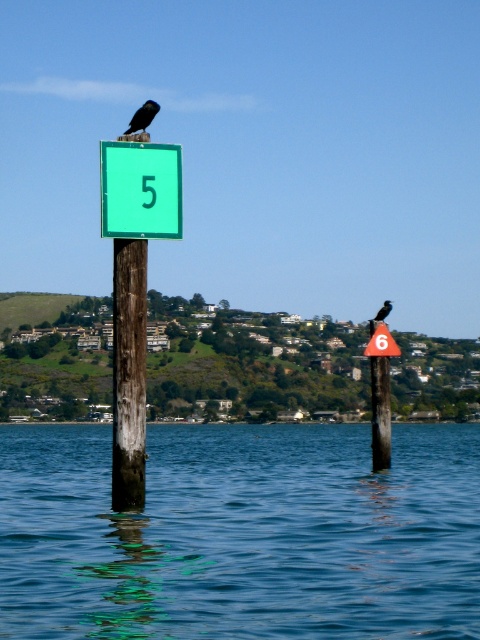
The height and width of the screenshot is (640, 480). Describe the element at coordinates (241, 534) in the screenshot. I see `transparent blue water at center` at that location.

Consider the image. Is transparent blue water at center closer to the viewer compared to red plastic triangle at right?

Yes, it is in front of red plastic triangle at right.

The image size is (480, 640). Identify the location of transparent blue water at center. (241, 534).

This screenshot has height=640, width=480. I want to click on transparent blue water at center, so click(x=241, y=534).

Is the position of green matte sign at upper center more distant than that of smooth wood post at right?

No, green matte sign at upper center is in front of smooth wood post at right.

Is green matte sign at upper center above smooth wood post at right?

Yes.

Is point (170, 227) closer to camera compared to point (375, 381)?

Yes, point (170, 227) is closer to viewer.

The width and height of the screenshot is (480, 640). Find the location of `green matte sign at upper center`. green matte sign at upper center is located at coordinates (141, 189).

Who is positioned more to the right, transparent blue water at center or green matte sign at upper center?

From the viewer's perspective, transparent blue water at center appears more on the right side.

Can you confirm if transparent blue water at center is smaller than green matte sign at upper center?

Actually, transparent blue water at center might be larger than green matte sign at upper center.

Does point (247, 604) come farther from viewer compared to point (112, 157)?

No, it is in front of (112, 157).

Locate an element on the screen. transparent blue water at center is located at coordinates (241, 534).